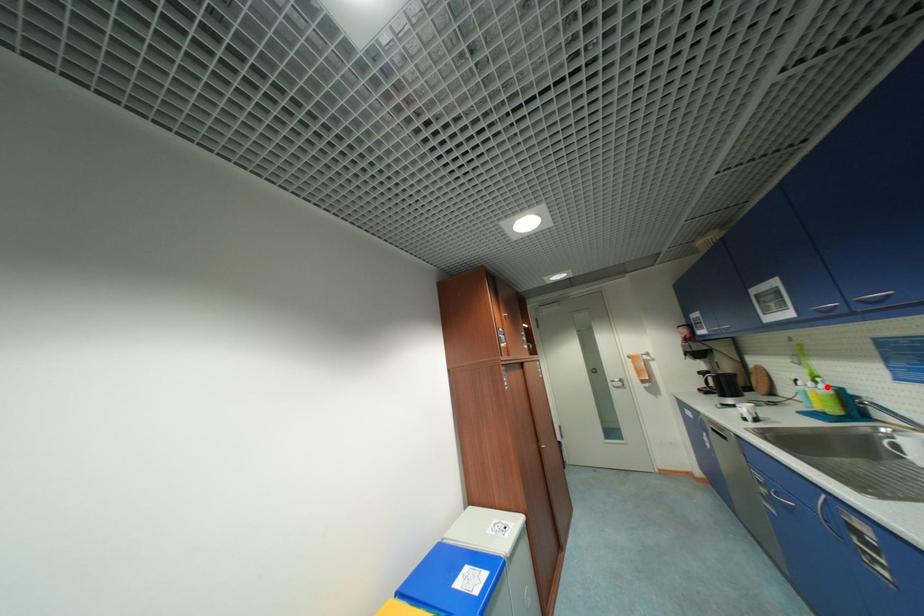
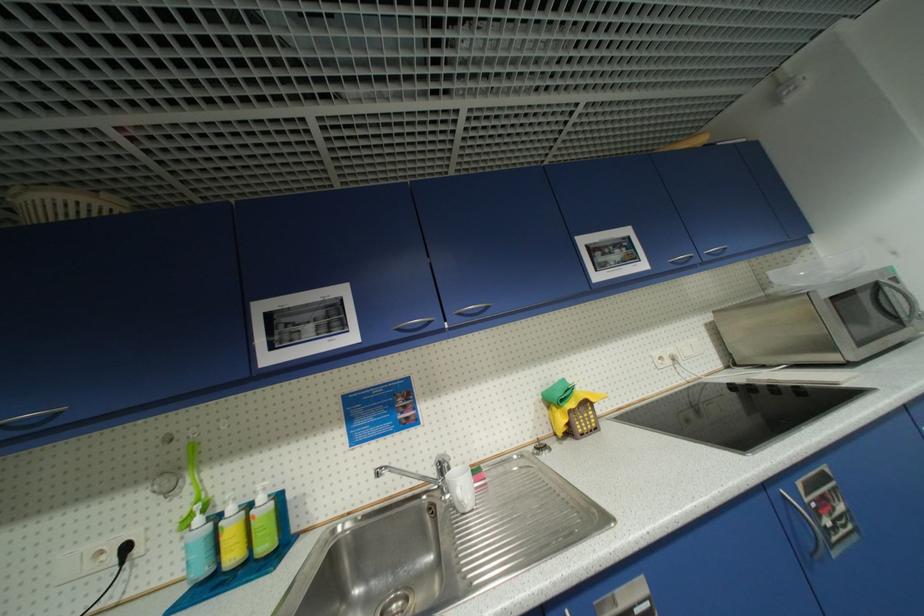
The point at the highlighted location is marked in the first image. Where is the corresponding point in the second image?

(266, 500)